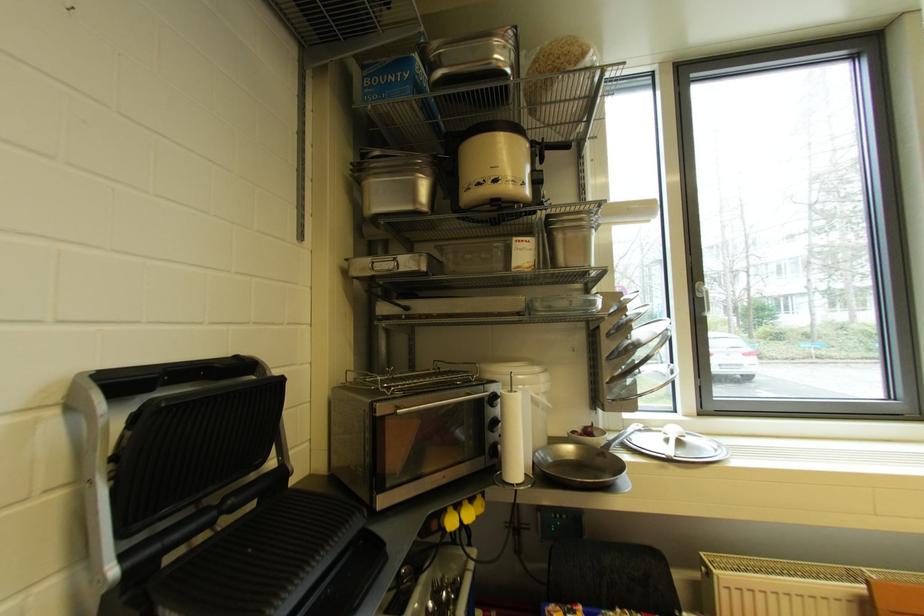
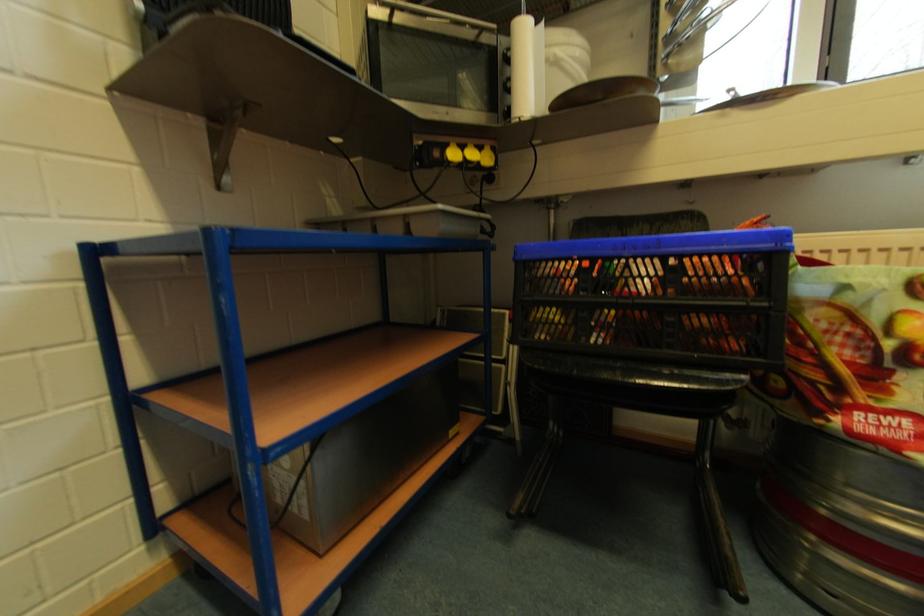
Question: The camera is either moving clockwise (left) or counter-clockwise (right) around the object. The first image is from the beginning of the video and the second image is from the end. Is the camera moving left or right when shooting the video?

Choices:
 (A) Left
 (B) Right

Answer: (B)